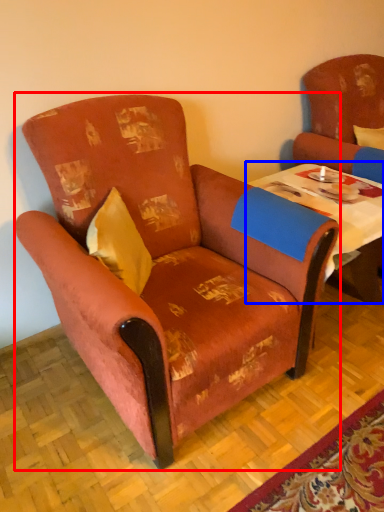
Question: Which object is further to the camera taking this photo, chair (highlighted by a red box) or table (highlighted by a blue box)?

Choices:
 (A) chair
 (B) table

Answer: (B)